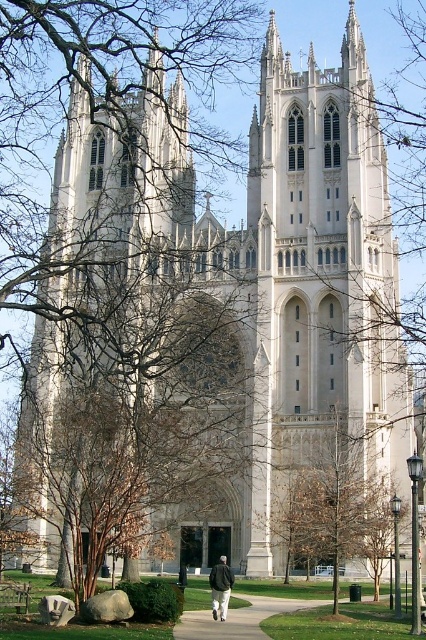
Question: Observing the image, what is the correct spatial positioning of concrete sidewalk at lower center in reference to dark gray jacket at center?

Choices:
 (A) left
 (B) right

Answer: (B)

Question: Is the position of brown leafy tree at center less distant than that of dark gray jacket at center?

Choices:
 (A) yes
 (B) no

Answer: (B)

Question: Based on their relative distances, which object is nearer to the concrete sidewalk at lower center?

Choices:
 (A) brown leafy tree at center
 (B) dark gray jacket at center

Answer: (B)

Question: Which object appears closest to the camera in this image?

Choices:
 (A) dark gray jacket at center
 (B) concrete sidewalk at lower center
 (C) brown leafy tree at center

Answer: (B)

Question: In this image, where is brown leafy tree at center located relative to concrete sidewalk at lower center?

Choices:
 (A) below
 (B) above

Answer: (B)

Question: Which of these objects is positioned farthest from the brown leafy tree at center?

Choices:
 (A) dark gray jacket at center
 (B) concrete sidewalk at lower center

Answer: (A)